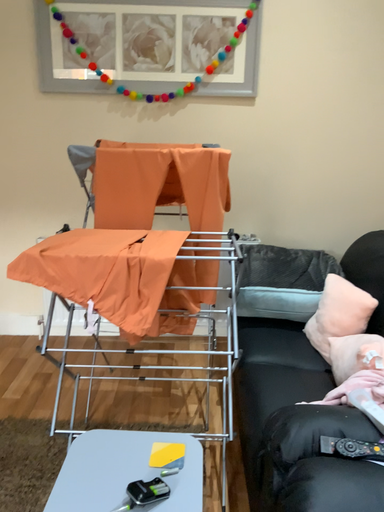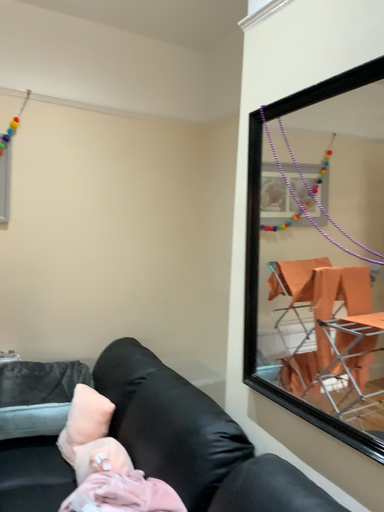
Question: How did the camera likely rotate when shooting the video?

Choices:
 (A) rotated left
 (B) rotated right

Answer: (B)